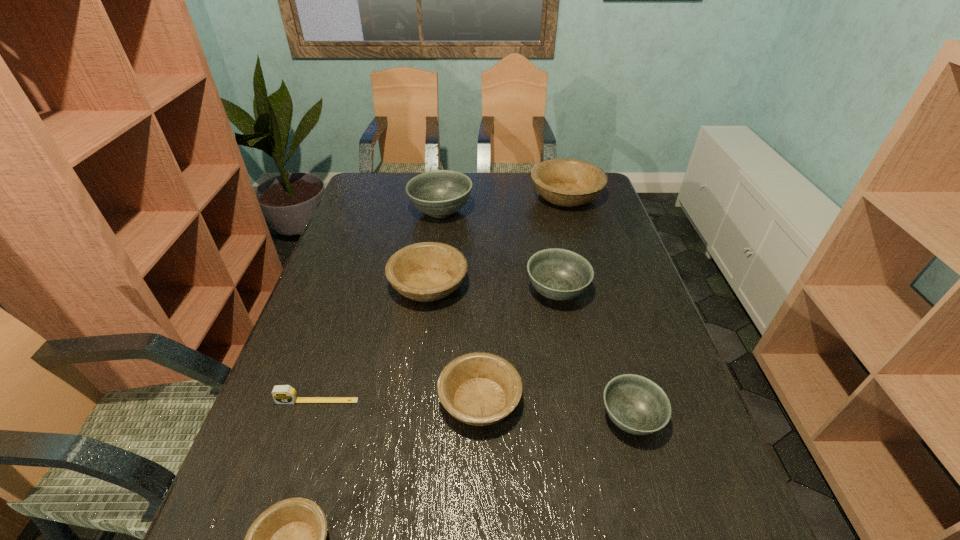
Where is `blank space at the right edge of the desktop`? This screenshot has height=540, width=960. blank space at the right edge of the desktop is located at coordinates (581, 220).

This screenshot has height=540, width=960. In the image, there is a desktop. Identify the location of blank space at the far left corner. (373, 189).

At what (x,y) coordinates should I click in order to perform the action: click on free space between the biggest beige bowl and the second farthest beige bowl. Please return your answer as a coordinate pair (x, y). Looking at the image, I should click on (497, 241).

Locate an element on the screen. The image size is (960, 540). vacant space in between the third farthest beige bowl and the second farthest beige bowl is located at coordinates (454, 343).

This screenshot has width=960, height=540. I want to click on free space between the farthest gray bowl and the biggest beige bowl, so [503, 204].

You are a GUI agent. You are given a task and a screenshot of the screen. Output one action in this format:
    pyautogui.click(x=<x>, y=<y>)
    Task: Click on the vacant space in between the third farthest beige bowl and the farthest beige bowl
    The width and height of the screenshot is (960, 540).
    Given the screenshot: What is the action you would take?
    pyautogui.click(x=523, y=299)

Image resolution: width=960 pixels, height=540 pixels. I want to click on vacant area that lies between the rightmost beige bowl and the nearest gray bowl, so click(598, 307).

The height and width of the screenshot is (540, 960). What are the coordinates of `vacant area that lies between the second biggest beige bowl and the tape measure` in the screenshot? It's located at (373, 343).

Where is `object that can be found as the fifth closest to the shortest bowl`? Image resolution: width=960 pixels, height=540 pixels. object that can be found as the fifth closest to the shortest bowl is located at coordinates (559, 274).

The height and width of the screenshot is (540, 960). In order to click on object that stands as the second closest to the biggest beige bowl in this screenshot , I will do `click(559, 274)`.